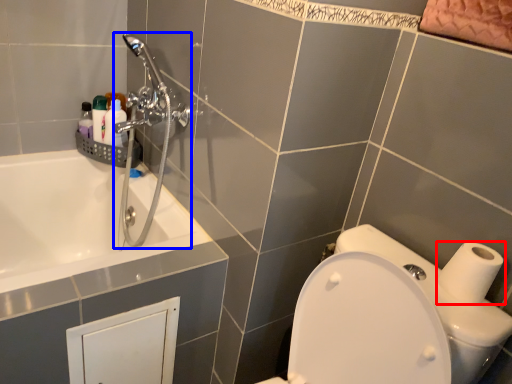
Question: Which object is closer to the camera taking this photo, toilet paper (highlighted by a red box) or shower (highlighted by a blue box)?

Choices:
 (A) toilet paper
 (B) shower

Answer: (A)